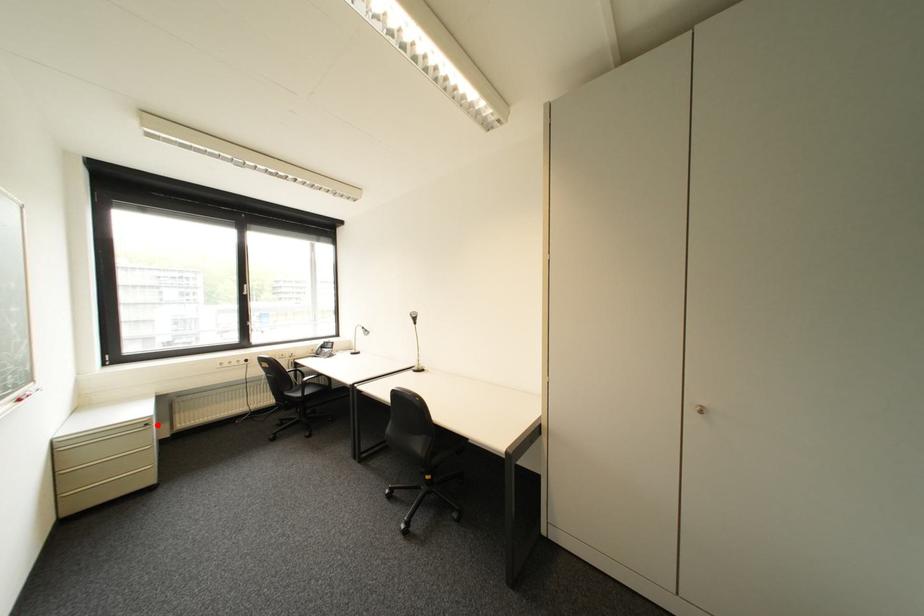
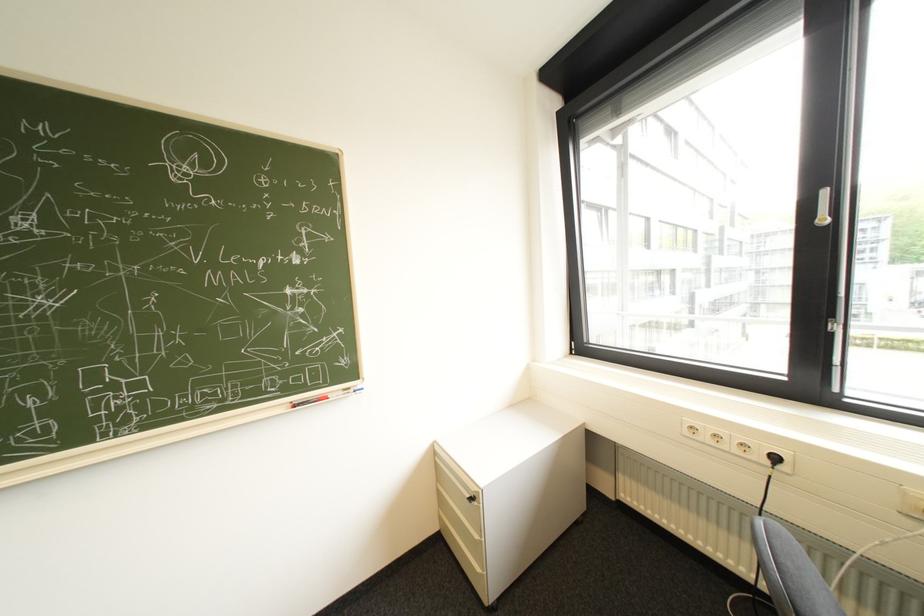
Question: A red point is marked in image1. In image2, is the corresponding 3D point closer to the camera or farther? Reply with the corresponding letter.

Choices:
 (A) The corresponding 3D point is closer.
 (B) The corresponding 3D point is farther.

Answer: (B)